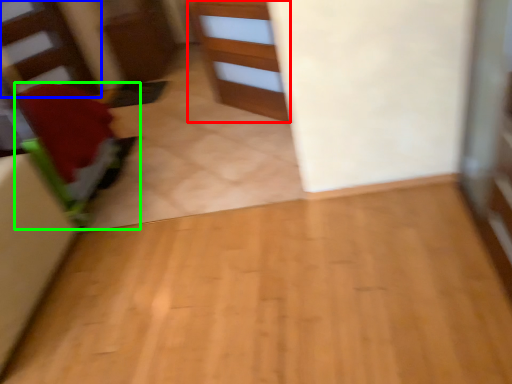
Question: Based on their relative distances, which object is farther from cabinetry (highlighted by a red box)? Choose from stairwell (highlighted by a blue box) and furniture (highlighted by a green box).

Choices:
 (A) stairwell
 (B) furniture

Answer: (A)